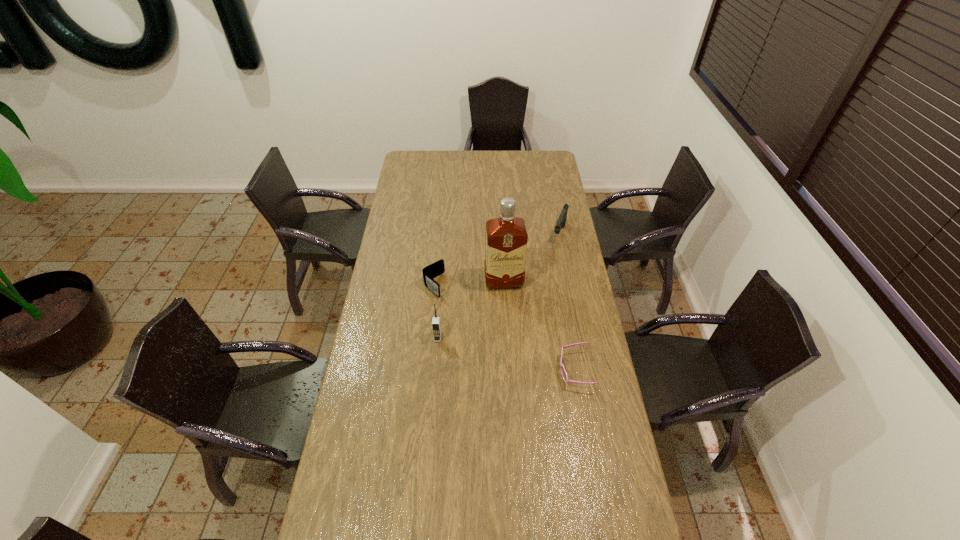
Locate an element on the screen. free space on the desktop that is between the second nearest object and the sunglasses and is positioned on the front label of the liquor is located at coordinates (515, 356).

Locate an element on the screen. free space on the desktop that is between the second nearest object and the shortest object and is positioned on the outer surface of the fourth tallest object is located at coordinates (511, 355).

Where is `vacant spot on the desktop that is between the second nearest object and the nearest object and is positioned at the barrel of the farthest object`? The width and height of the screenshot is (960, 540). vacant spot on the desktop that is between the second nearest object and the nearest object and is positioned at the barrel of the farthest object is located at coordinates (511, 355).